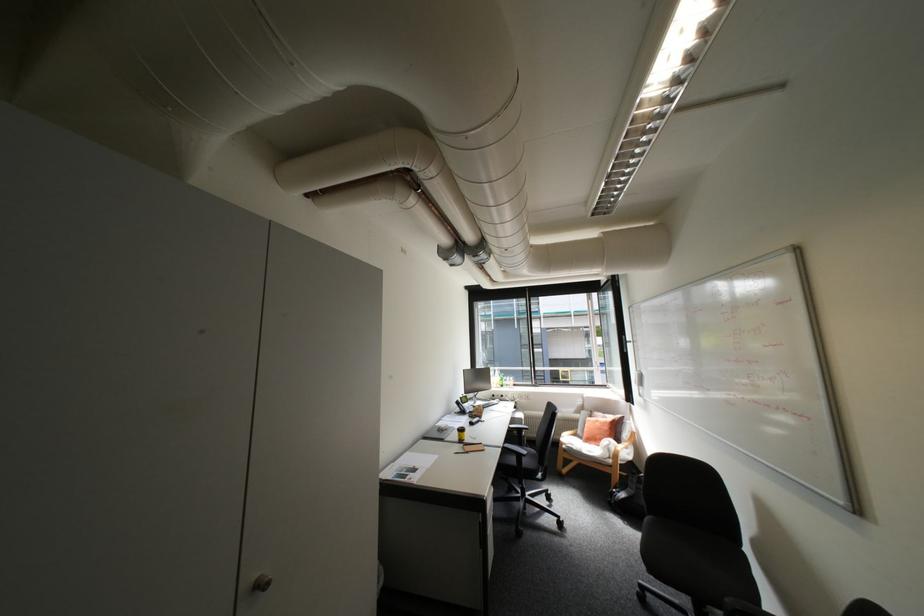
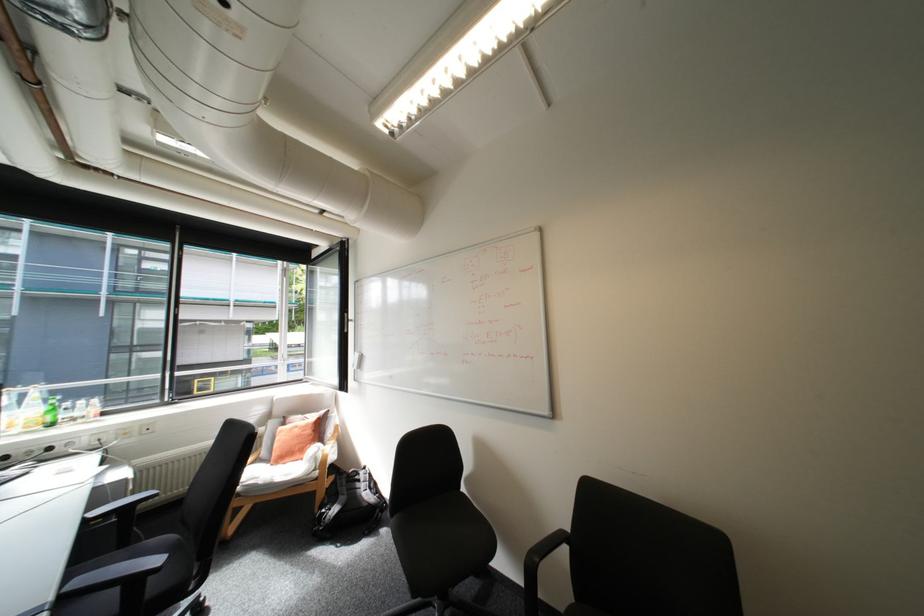
In the second image, find the point that corresponds to (608,423) in the first image.

(307, 429)